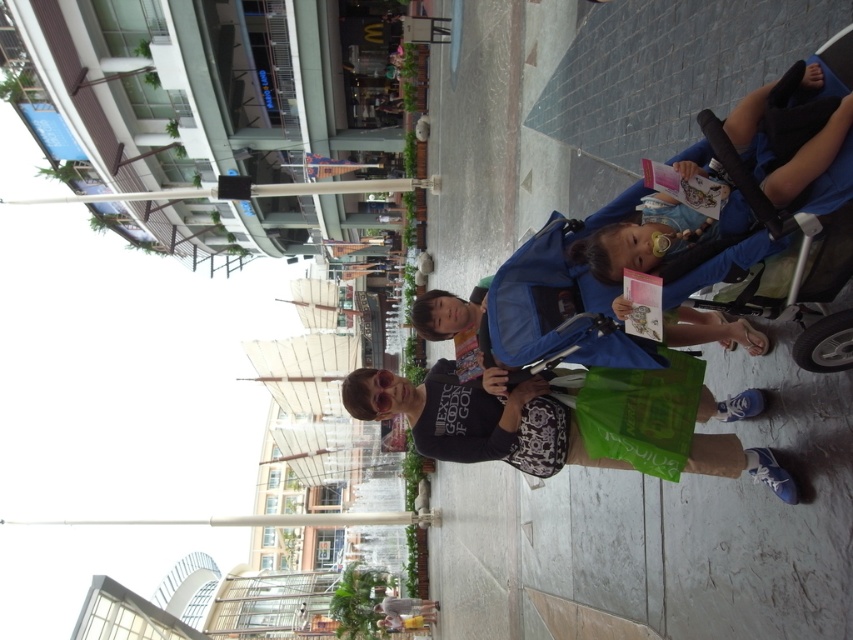
Question: Does blue fabric baby carriage at center appear on the right side of black matte t-shirt at center?

Choices:
 (A) no
 (B) yes

Answer: (B)

Question: Can you confirm if blue fabric baby carriage at center is positioned below black matte t-shirt at center?

Choices:
 (A) no
 (B) yes

Answer: (A)

Question: Which point is farther to the camera?

Choices:
 (A) blue fabric baby carriage at center
 (B) black matte t-shirt at center

Answer: (B)

Question: Which point is farther to the camera?

Choices:
 (A) (506, 417)
 (B) (821, 173)

Answer: (A)

Question: Is blue fabric baby carriage at center to the right of black matte t-shirt at center from the viewer's perspective?

Choices:
 (A) no
 (B) yes

Answer: (B)